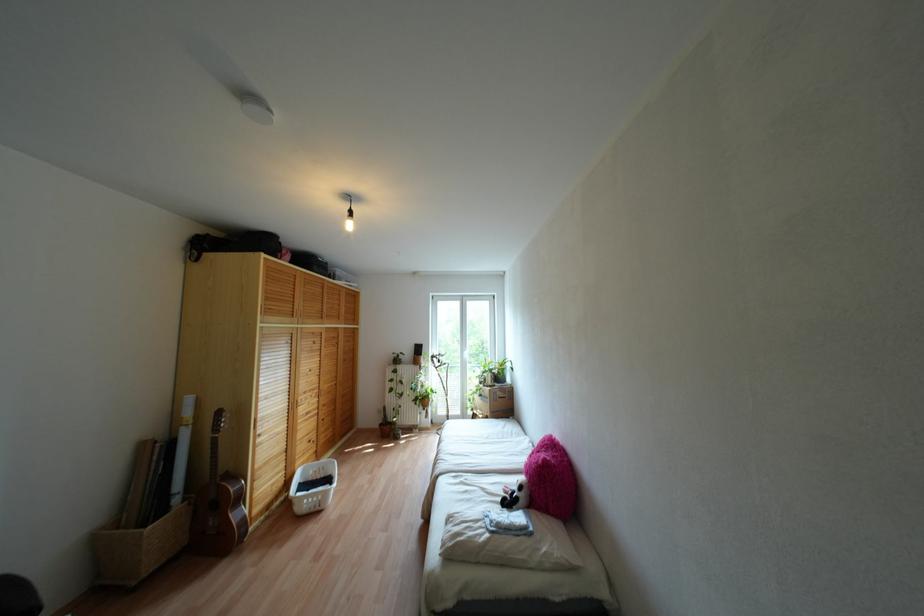
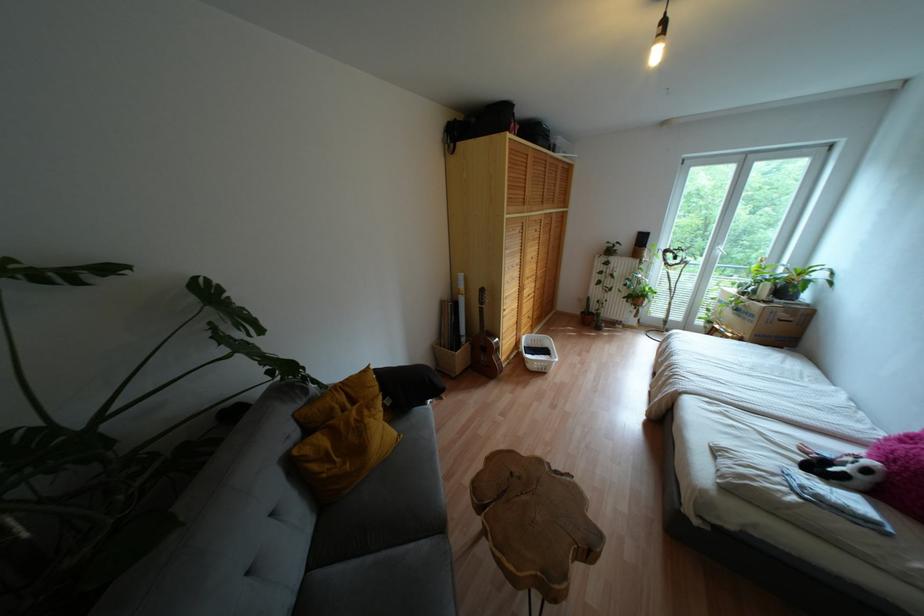
Find the pixel in the second image that matches (519,487) in the first image.

(867, 471)